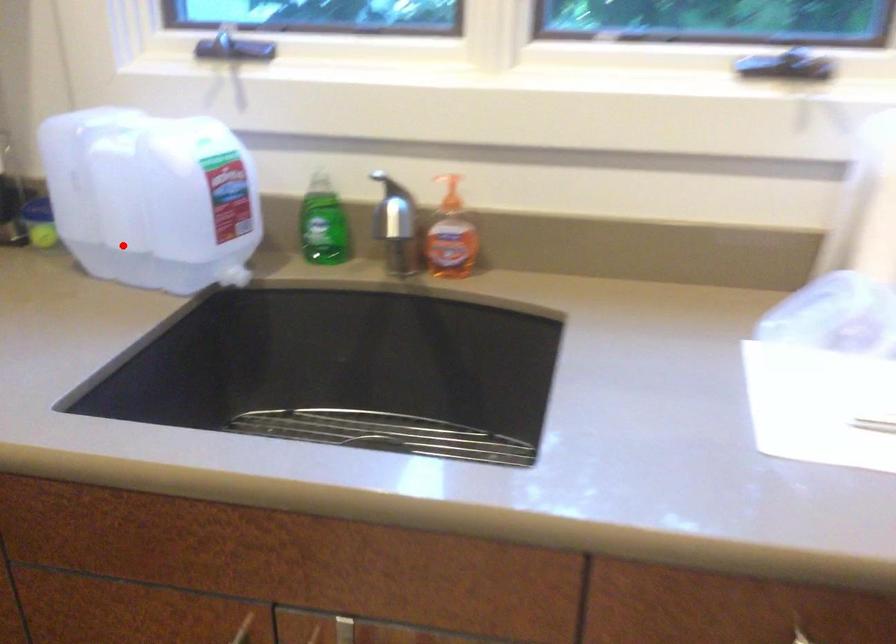
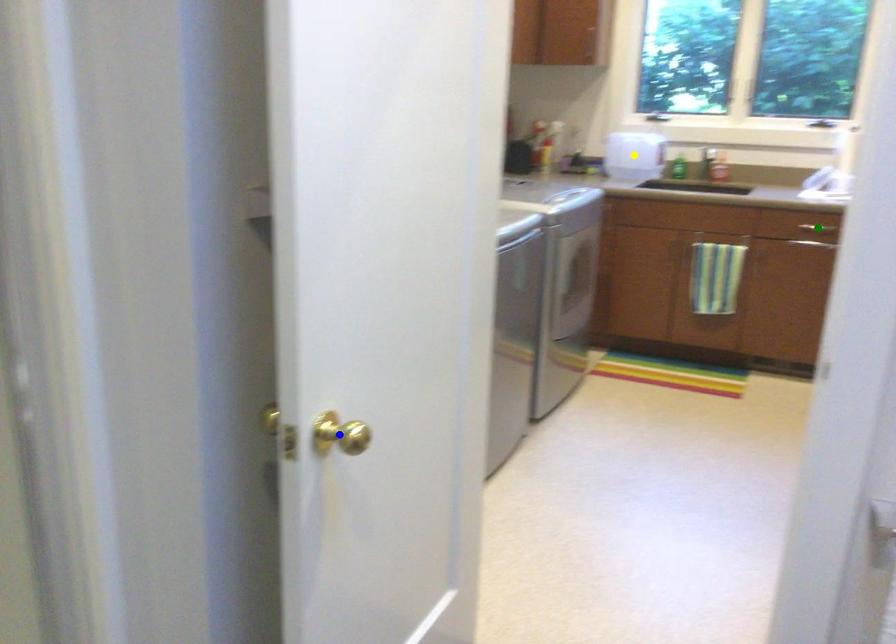
Question: I am providing you with two images of the same scene from different viewpoints. A red point is marked on the first image. You are given multiple points on the second image. In image 2, which mark is for the same physical point as the one in image 1?

Choices:
 (A) yellow point
 (B) green point
 (C) blue point

Answer: (A)